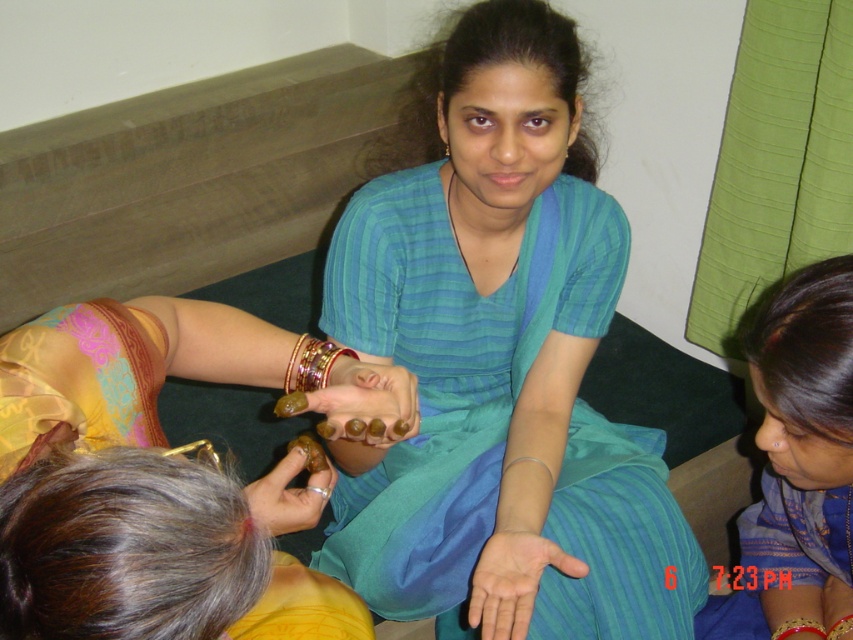
Is gold painted nails at center closer to camera compared to gold metallic bracelet at center?

Yes, gold painted nails at center is closer to the viewer.

Is gold painted nails at center thinner than gold metallic bracelet at center?

In fact, gold painted nails at center might be wider than gold metallic bracelet at center.

Where is `gold painted nails at center`? The height and width of the screenshot is (640, 853). gold painted nails at center is located at coordinates (366, 401).

Between point (836, 556) and point (839, 570), which one is positioned behind?

Point (839, 570)

Between blue satin saree at lower right and blue satin dress at lower right, which one appears on the left side from the viewer's perspective?

blue satin saree at lower right

This screenshot has width=853, height=640. Describe the element at coordinates (798, 460) in the screenshot. I see `blue satin saree at lower right` at that location.

Where is `blue satin saree at lower right`? blue satin saree at lower right is located at coordinates (798, 460).

Which of these two, blue satin saree at lower right or gold painted nails at center, stands shorter?

gold painted nails at center is shorter.

Between blue satin saree at lower right and gold painted nails at center, which one appears on the right side from the viewer's perspective?

blue satin saree at lower right is more to the right.

Who is more forward, (833, 388) or (344, 392)?

Point (344, 392) is more forward.

Where is `blue satin saree at lower right`? Image resolution: width=853 pixels, height=640 pixels. blue satin saree at lower right is located at coordinates (x=798, y=460).